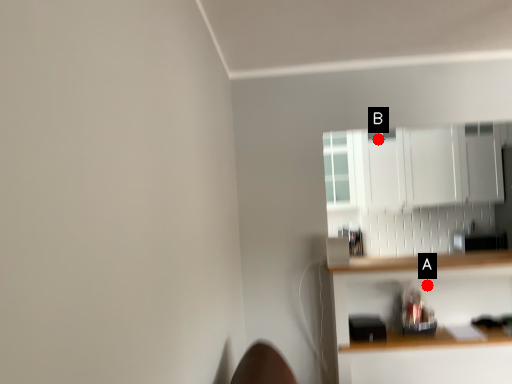
Question: Two points are circled on the image, labeled by A and B beside each circle. Which point is closer to the camera?

Choices:
 (A) A is closer
 (B) B is closer

Answer: (A)